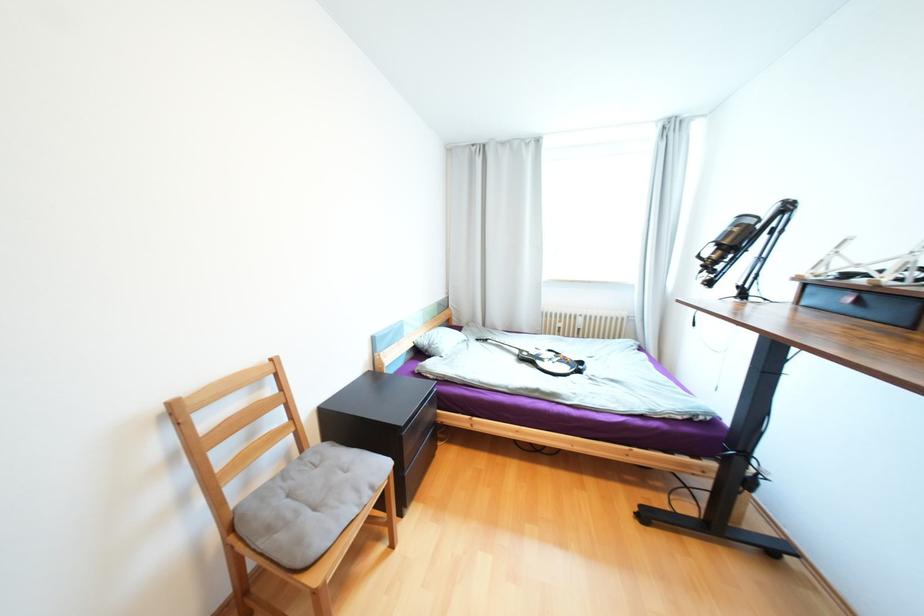
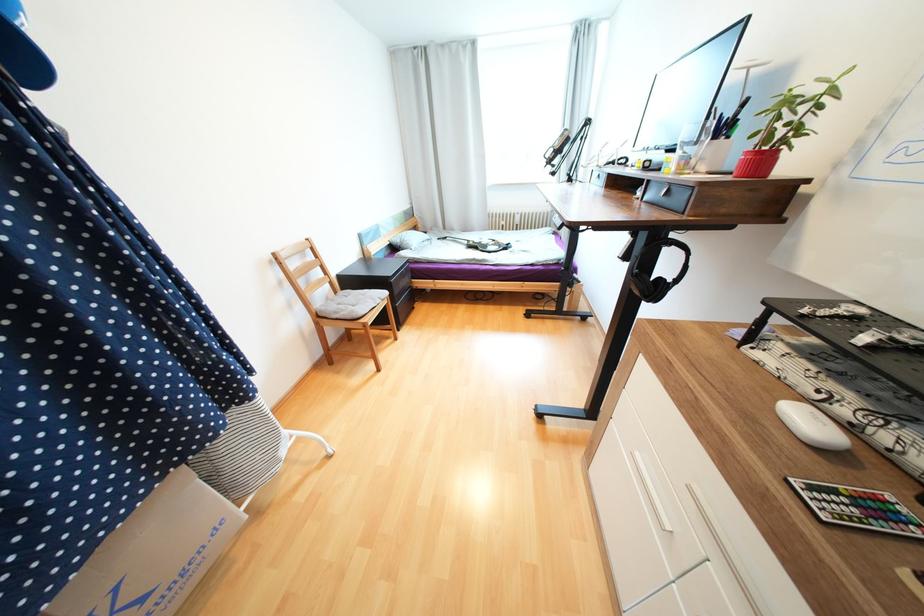
Find the pixel in the second image that matches the point at 363,492 in the first image.

(379, 300)